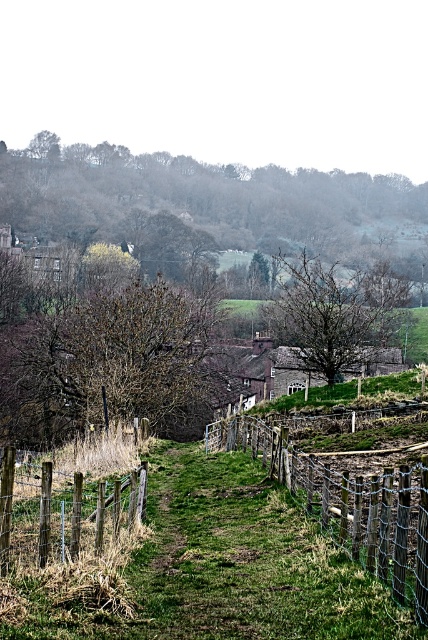
You are a painter setting up an easel to paint the scene. You want to focus on capturing the brown leafless tree at upper center and the wooden wire fence at center. Which object should you position closer to the foreground to emphasize its width in your painting?

The brown leafless tree at upper center might be wider than the wooden wire fence at center, so to emphasize its width, you should position the brown leafless tree at upper center closer to the foreground in your painting.

You are a painter setting up your easel to capture the rural landscape. You want to include both the wooden wire fence at center and the brown wooden fence at lower left in your painting. Which fence should you focus on to emphasize its size in the composition?

The wooden wire fence at center should be focused on because its width is larger than the brown wooden fence at lower left, making it a better subject for emphasizing size in the composition.